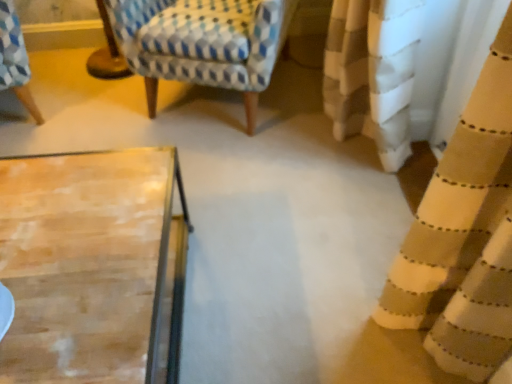
Question: Looking at the image, does beige textured curtain at right seem bigger or smaller compared to patterned fabric rocking chair at upper left?

Choices:
 (A) small
 (B) big

Answer: (A)

Question: Is beige textured curtain at right wider or thinner than patterned fabric rocking chair at upper left?

Choices:
 (A) wide
 (B) thin

Answer: (B)

Question: Is beige textured curtain at right in front of or behind patterned fabric rocking chair at upper left in the image?

Choices:
 (A) front
 (B) behind

Answer: (A)

Question: From the image's perspective, is patterned fabric rocking chair at upper left positioned above or below beige textured curtain at right?

Choices:
 (A) below
 (B) above

Answer: (B)

Question: From a real-world perspective, is patterned fabric rocking chair at upper left positioned above or below beige textured curtain at right?

Choices:
 (A) above
 (B) below

Answer: (B)

Question: Would you say patterned fabric rocking chair at upper left is to the left or to the right of beige textured curtain at right in the picture?

Choices:
 (A) right
 (B) left

Answer: (B)

Question: From their relative heights in the image, would you say patterned fabric rocking chair at upper left is taller or shorter than beige textured curtain at right?

Choices:
 (A) short
 (B) tall

Answer: (A)